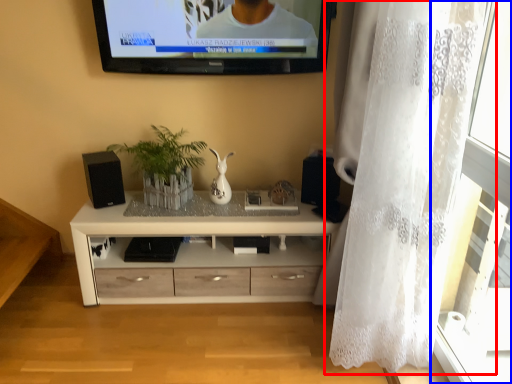
Question: Which object appears farthest to the camera in this image, curtain (highlighted by a red box) or glass door (highlighted by a blue box)?

Choices:
 (A) curtain
 (B) glass door

Answer: (A)